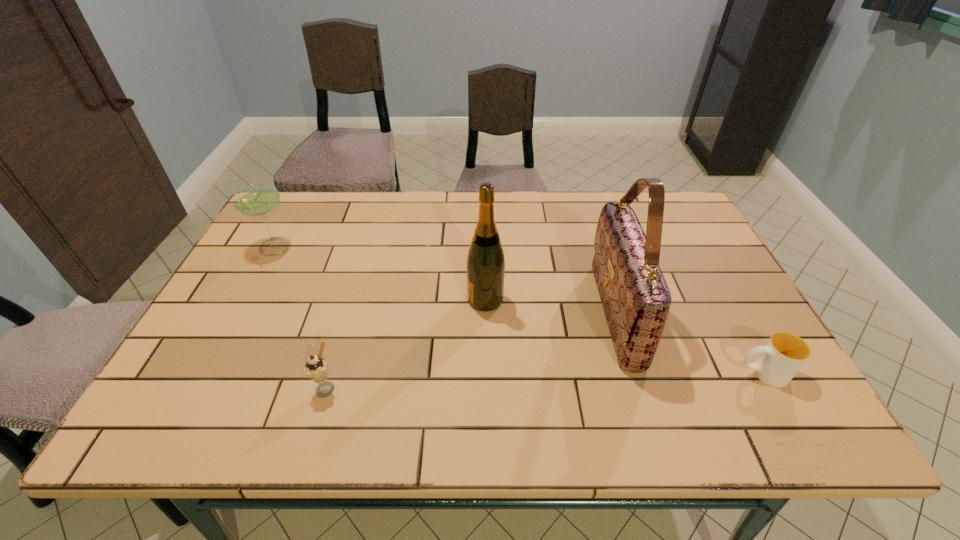
Image resolution: width=960 pixels, height=540 pixels. Identify the location of handbag. (636, 300).

This screenshot has width=960, height=540. Identify the location of the third object from left to right. (485, 261).

The width and height of the screenshot is (960, 540). In order to click on the third tallest object in this screenshot , I will do `click(260, 199)`.

Where is `martini`? The image size is (960, 540). martini is located at coordinates tap(260, 199).

This screenshot has height=540, width=960. I want to click on the fourth object from right to left, so click(316, 367).

At what (x,y) coordinates should I click in order to perform the action: click on the fourth tallest object. Please return your answer as a coordinate pair (x, y). The height and width of the screenshot is (540, 960). Looking at the image, I should click on (316, 367).

The height and width of the screenshot is (540, 960). What are the coordinates of `the shortest object` in the screenshot? It's located at (780, 359).

Find the location of a particular element. the rightmost object is located at coordinates (780, 359).

Identify the location of free space located 0.050m on the front of the handbag with the clasp. (577, 313).

Where is `vacant space located 0.090m on the front of the handbag with the clasp`? Image resolution: width=960 pixels, height=540 pixels. vacant space located 0.090m on the front of the handbag with the clasp is located at coordinates (561, 313).